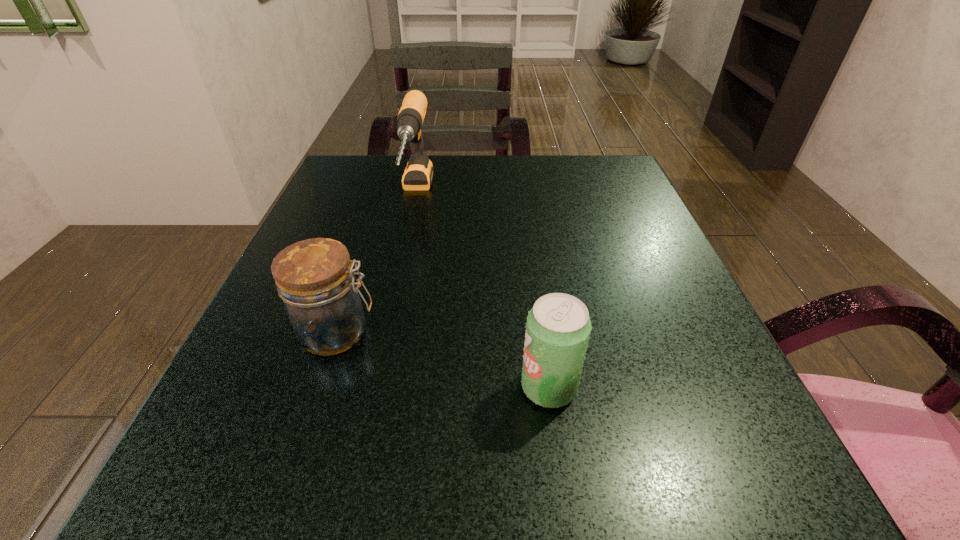
Image resolution: width=960 pixels, height=540 pixels. In order to click on vacant space at the far edge of the desktop in this screenshot , I will do `click(435, 193)`.

Where is `vacant space at the left edge of the desktop`? The height and width of the screenshot is (540, 960). vacant space at the left edge of the desktop is located at coordinates (348, 249).

Find the location of `vacant space at the right edge of the desktop`. vacant space at the right edge of the desktop is located at coordinates (613, 278).

Identify the location of free space at the far left corner. (375, 168).

Identify the location of free spot at the near left corner of the desktop. This screenshot has width=960, height=540. (296, 522).

Image resolution: width=960 pixels, height=540 pixels. In order to click on free space at the far right corner in this screenshot , I will do `click(576, 184)`.

I want to click on vacant region at the near right corner, so click(x=681, y=482).

I want to click on empty location between the drill and the jar, so click(x=376, y=264).

Locate an element on the screen. vacant space in between the second farthest object and the rightmost object is located at coordinates (443, 360).

The width and height of the screenshot is (960, 540). I want to click on free spot between the tallest object and the nearest object, so [x=482, y=291].